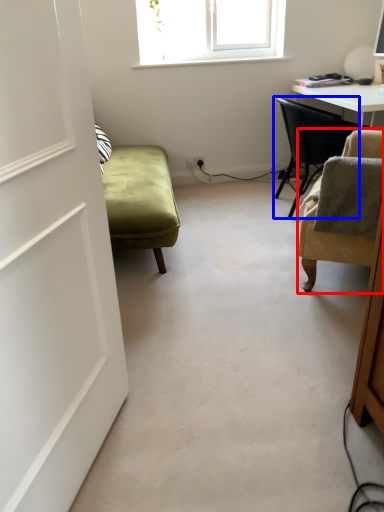
Question: Which object is further to the camera taking this photo, chair (highlighted by a red box) or chair (highlighted by a blue box)?

Choices:
 (A) chair
 (B) chair

Answer: (B)